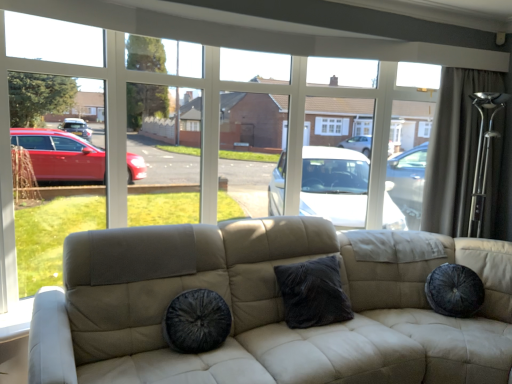
Question: From the image's perspective, is velvet dark gray pillow at center above or below velvet black dog bed at center?

Choices:
 (A) above
 (B) below

Answer: (A)

Question: Looking at their shapes, would you say velvet dark gray pillow at center is wider or thinner than velvet black dog bed at center?

Choices:
 (A) wide
 (B) thin

Answer: (B)

Question: Which object is positioned closest to the dark gray fabric curtain at upper right?

Choices:
 (A) velvet black dog bed at center
 (B) velvet dark gray pillow at center

Answer: (B)

Question: Considering the real-world distances, which object is farthest from the velvet dark gray pillow at center?

Choices:
 (A) dark gray fabric curtain at upper right
 (B) velvet black dog bed at center

Answer: (A)